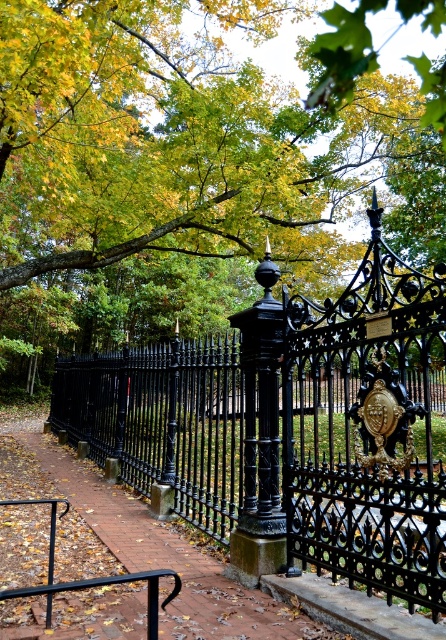
Does black wrought iron fence at center lie in front of brown brick path at center?

Yes, it is.

Between point (191, 520) and point (24, 451), which one is positioned in front?

Point (191, 520) is more forward.

Which is in front, point (301, 474) or point (161, 557)?

Point (301, 474) is in front.

I want to click on black wrought iron fence at center, so click(x=293, y=424).

Does green leafy tree at upper center lie in front of brown brick path at center?

Yes, it is in front of brown brick path at center.

Does green leafy tree at upper center have a greater height compared to brown brick path at center?

Yes.

Identify the location of green leafy tree at upper center. (186, 170).

This screenshot has width=446, height=640. What are the coordinates of `green leafy tree at upper center` in the screenshot? It's located at (186, 170).

Measure the distance between point (243, 273) and camera.

They are 26.46 meters apart.

Which is above, green leafy tree at upper center or black wrought iron fence at center?

green leafy tree at upper center is higher up.

The image size is (446, 640). In order to click on green leafy tree at upper center in this screenshot , I will do `click(186, 170)`.